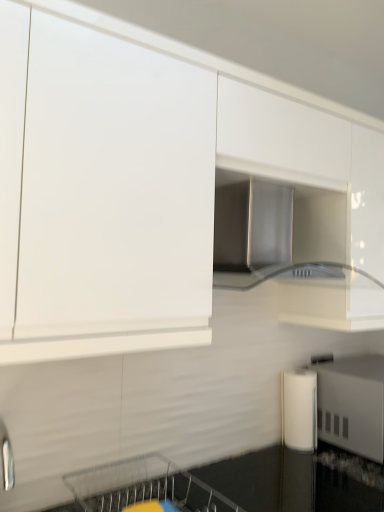
Question: From the image's perspective, is metallic silver dishwasher at lower center on top of stainless steel range hood at center?

Choices:
 (A) yes
 (B) no

Answer: (B)

Question: From a real-world perspective, is metallic silver dishwasher at lower center physically above stainless steel range hood at center?

Choices:
 (A) yes
 (B) no

Answer: (B)

Question: From a real-world perspective, is metallic silver dishwasher at lower center below stainless steel range hood at center?

Choices:
 (A) no
 (B) yes

Answer: (B)

Question: Is metallic silver dishwasher at lower center not near stainless steel range hood at center?

Choices:
 (A) no
 (B) yes

Answer: (A)

Question: Does metallic silver dishwasher at lower center contain stainless steel range hood at center?

Choices:
 (A) no
 (B) yes

Answer: (A)

Question: Would you say stainless steel range hood at center is to the left or to the right of white glossy cabinet at upper center in the picture?

Choices:
 (A) left
 (B) right

Answer: (A)

Question: From a real-world perspective, is stainless steel range hood at center positioned above or below white glossy cabinet at upper center?

Choices:
 (A) above
 (B) below

Answer: (B)

Question: Based on their sizes in the image, would you say stainless steel range hood at center is bigger or smaller than white glossy cabinet at upper center?

Choices:
 (A) big
 (B) small

Answer: (B)

Question: Considering the positions of point (264, 186) and point (193, 328), is point (264, 186) closer or farther from the camera than point (193, 328)?

Choices:
 (A) farther
 (B) closer

Answer: (A)

Question: In the image, is white glossy cabinet at upper center positioned in front of or behind stainless steel range hood at center?

Choices:
 (A) front
 (B) behind

Answer: (A)

Question: From their relative heights in the image, would you say white glossy cabinet at upper center is taller or shorter than stainless steel range hood at center?

Choices:
 (A) tall
 (B) short

Answer: (A)

Question: In terms of width, does white glossy cabinet at upper center look wider or thinner when compared to stainless steel range hood at center?

Choices:
 (A) thin
 (B) wide

Answer: (A)

Question: In terms of size, does white glossy cabinet at upper center appear bigger or smaller than stainless steel range hood at center?

Choices:
 (A) small
 (B) big

Answer: (B)

Question: From their relative heights in the image, would you say white glossy cabinet at upper center is taller or shorter than metallic silver dishwasher at lower center?

Choices:
 (A) tall
 (B) short

Answer: (A)

Question: Would you say white glossy cabinet at upper center is to the left or to the right of metallic silver dishwasher at lower center in the picture?

Choices:
 (A) right
 (B) left

Answer: (A)